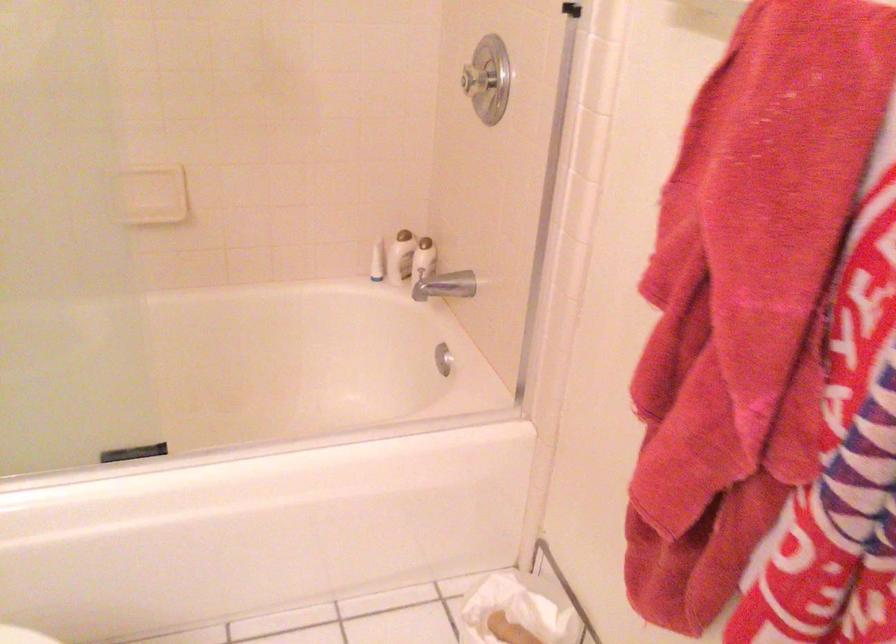
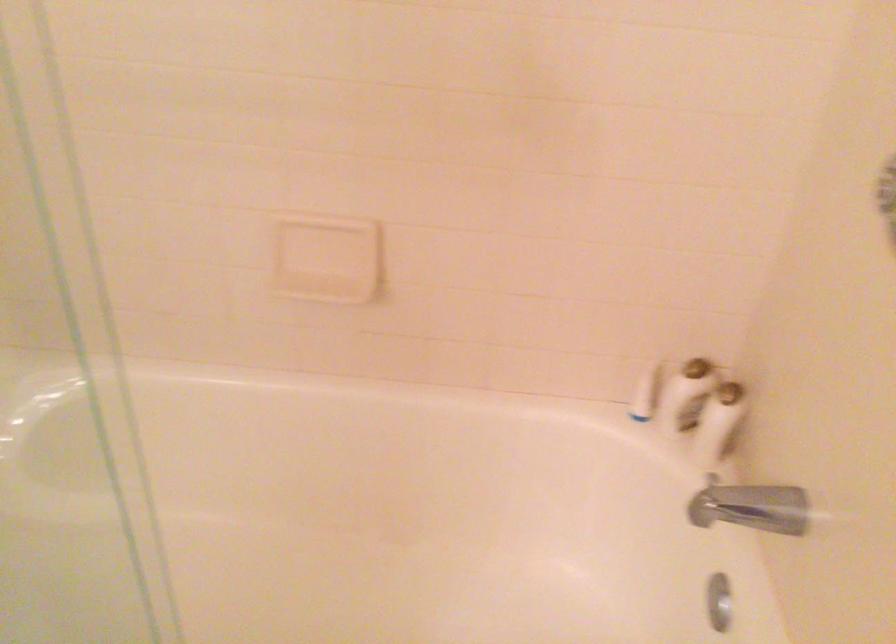
Question: The camera is either moving clockwise (left) or counter-clockwise (right) around the object. The first image is from the beginning of the video and the second image is from the end. Is the camera moving left or right when shooting the video?

Choices:
 (A) Left
 (B) Right

Answer: (B)